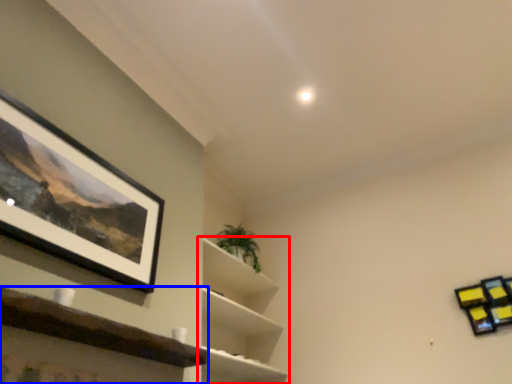
Question: Which object is further to the camera taking this photo, shelf (highlighted by a red box) or shelf (highlighted by a blue box)?

Choices:
 (A) shelf
 (B) shelf

Answer: (A)